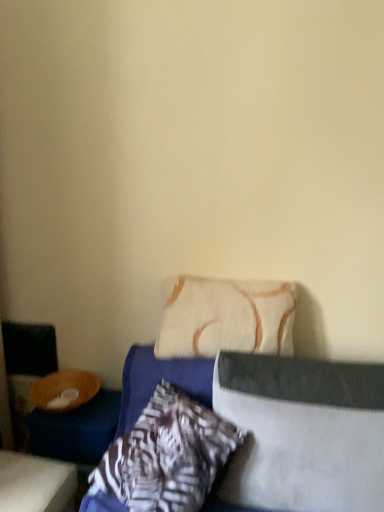
Question: Would you say textured beige pillow at center, which ranks as the 3th pillow in left-to-right order, is inside or outside wooden table at lower left?

Choices:
 (A) outside
 (B) inside

Answer: (A)

Question: Does point (289, 489) appear closer or farther from the camera than point (44, 476)?

Choices:
 (A) farther
 (B) closer

Answer: (B)

Question: Estimate the real-world distances between objects in this image. Which object is closer to the patterned fabric pillow at center, which is counted as the first pillow, starting from the left?

Choices:
 (A) beige textured pillow at center, which is counted as the 2th pillow, starting from the right
 (B) textured blue bed at center
 (C) wooden table at lower left
 (D) textured beige pillow at center, which ranks as the 3th pillow in left-to-right order

Answer: (B)

Question: Based on their relative distances, which object is nearer to the patterned fabric pillow at center, which is counted as the first pillow, starting from the left?

Choices:
 (A) textured beige pillow at center, which ranks as the 3th pillow in left-to-right order
 (B) wooden table at lower left
 (C) textured blue bed at center
 (D) beige textured pillow at center, the 2th pillow from the left

Answer: (C)